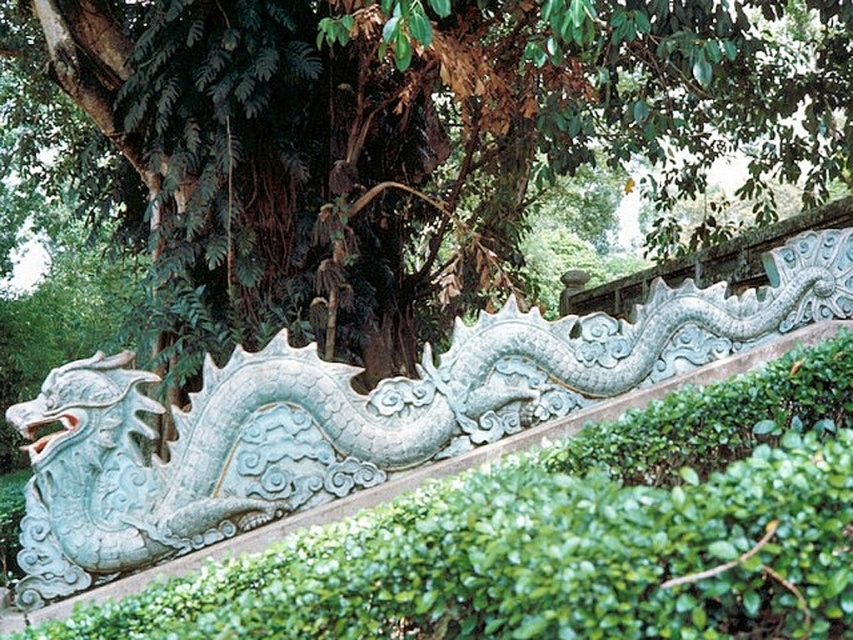
Does green leafy tree at center appear on the right side of light blue stone dragon at center?

In fact, green leafy tree at center is to the left of light blue stone dragon at center.

Is green leafy tree at center bigger than light blue stone dragon at center?

Actually, green leafy tree at center might be smaller than light blue stone dragon at center.

Who is more distant from viewer, (271, 147) or (132, 538)?

Positioned behind is point (271, 147).

You are a GUI agent. You are given a task and a screenshot of the screen. Output one action in this format:
    pyautogui.click(x=<x>, y=<y>)
    Task: Click on the green leafy tree at center
    The width and height of the screenshot is (853, 640).
    Given the screenshot: What is the action you would take?
    pyautogui.click(x=403, y=138)